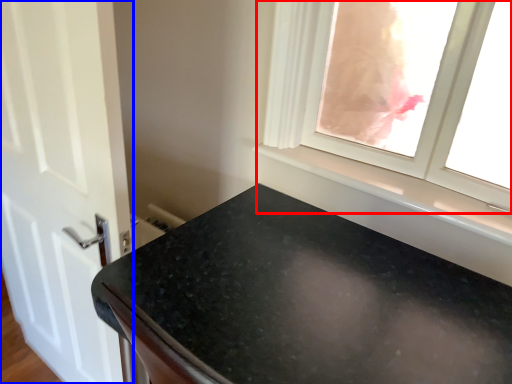
Question: Among these objects, which one is nearest to the camera, window (highlighted by a red box) or door (highlighted by a blue box)?

Choices:
 (A) window
 (B) door

Answer: (A)